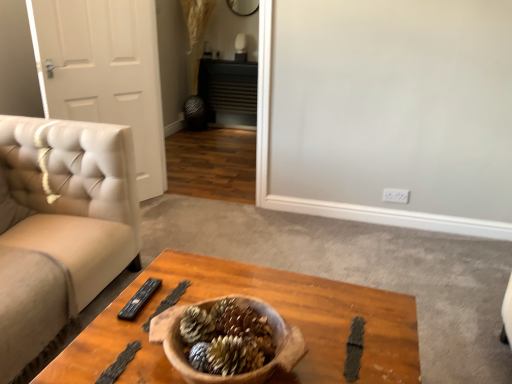
Find the location of a particular element. The width and height of the screenshot is (512, 384). free space in front of black plastic remote at center is located at coordinates (120, 332).